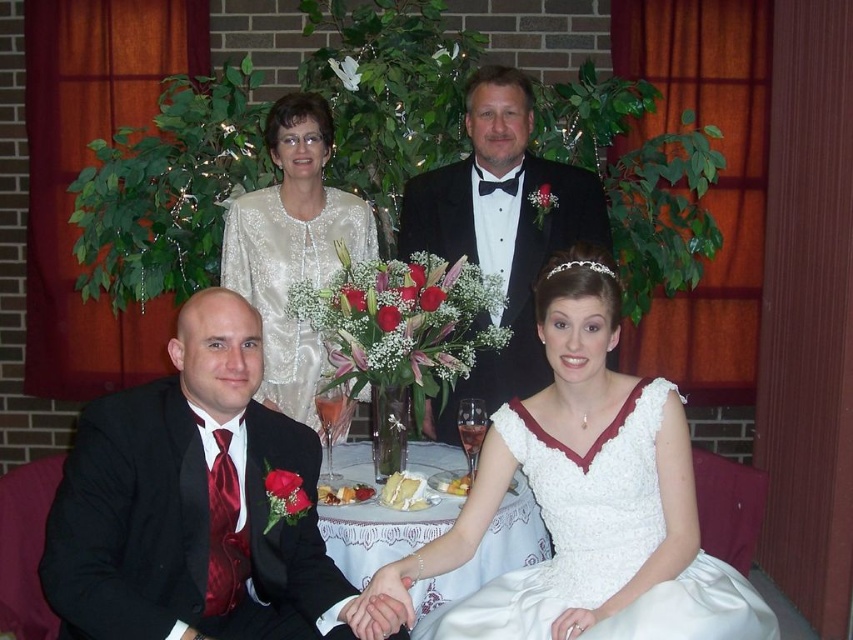
Question: Is white satin dress at lower center behind satin white dress at upper center?

Choices:
 (A) no
 (B) yes

Answer: (A)

Question: Among these objects, which one is farthest from the camera?

Choices:
 (A) matte black tuxedo at upper center
 (B) satin white dress at upper center
 (C) shiny red tie at lower left

Answer: (A)

Question: Which point is closer to the camera taking this photo?

Choices:
 (A) (498, 170)
 (B) (56, 588)

Answer: (B)

Question: Is shiny red tie at lower left to the left of white satin dress at lower center from the viewer's perspective?

Choices:
 (A) yes
 (B) no

Answer: (A)

Question: Which point is farther to the camera?

Choices:
 (A) satin white dress at upper center
 (B) matte black tuxedo at upper center

Answer: (B)

Question: Is shiny red tie at lower left smaller than satin white dress at upper center?

Choices:
 (A) yes
 (B) no

Answer: (A)